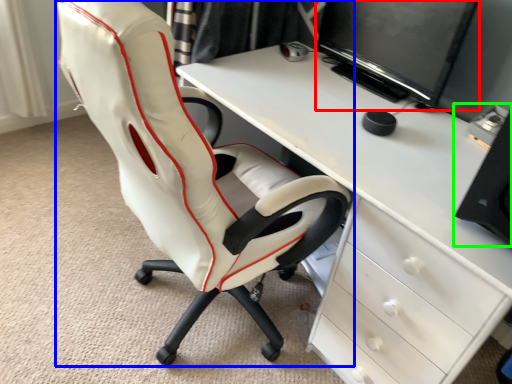
Question: Considering the real-world distances, which object is farthest from computer monitor (highlighted by a red box)? chair (highlighted by a blue box) or computer tower (highlighted by a green box)?

Choices:
 (A) chair
 (B) computer tower

Answer: (A)